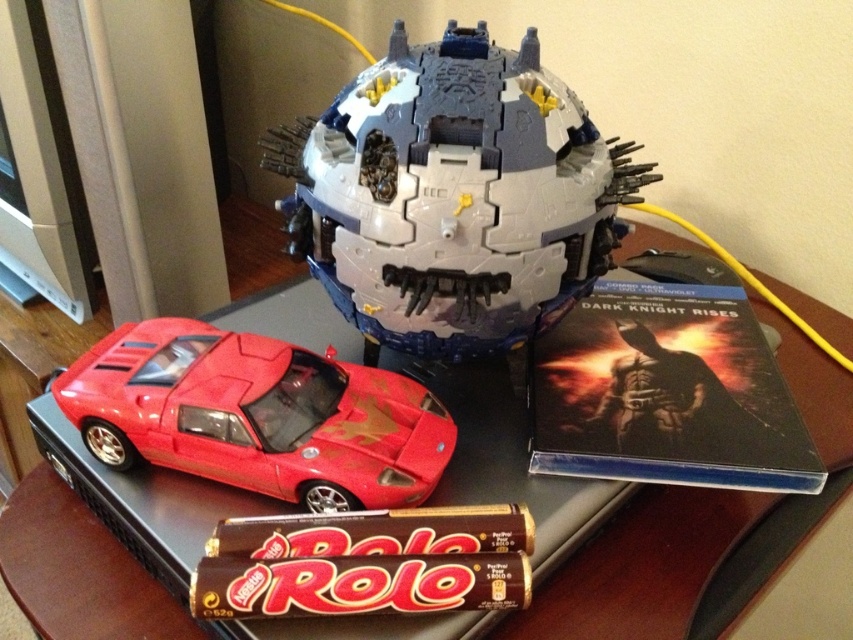
You are trying to place a small sticker on the plastic gray and blue robot head at center. Since the shiny black table at center is underneath it, can you access the bottom part of the robot head easily?

The plastic gray and blue robot head at center is located above the shiny black table at center, so you can access the bottom part of the robot head easily because it is not resting directly on the table.

In the scene shown: You are standing 24 inches away from the wooden table. You want to place the plastic gray and blue robot head at center on the table so that it is exactly 18 inches away from you. Is this possible?

The plastic gray and blue robot head at center is currently 20.06 inches away from the viewer. To achieve an 18 inch distance, you would need to move it closer by approximately 2.06 inches.